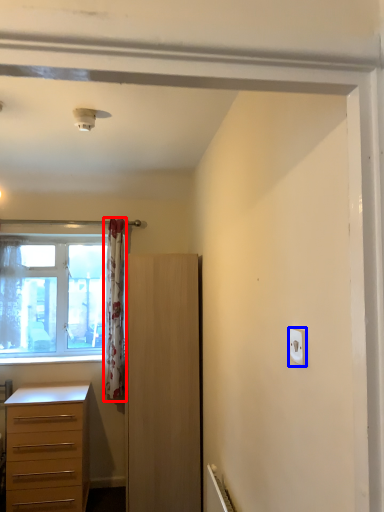
Question: Which point is closer to the camera, curtain (highlighted by a red box) or light switch (highlighted by a blue box)?

Choices:
 (A) curtain
 (B) light switch

Answer: (B)